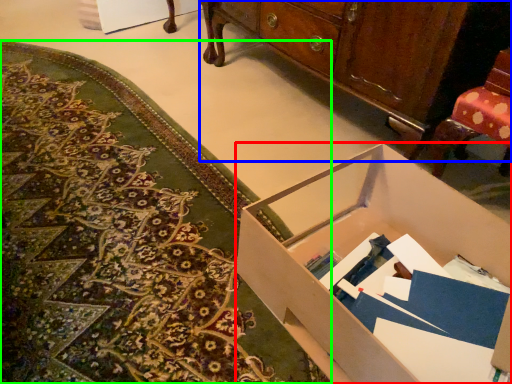
Question: Estimate the real-world distances between objects in this image. Which object is farther from desk (highlighted by a red box), cabinetry (highlighted by a blue box) or mat (highlighted by a green box)?

Choices:
 (A) cabinetry
 (B) mat

Answer: (A)